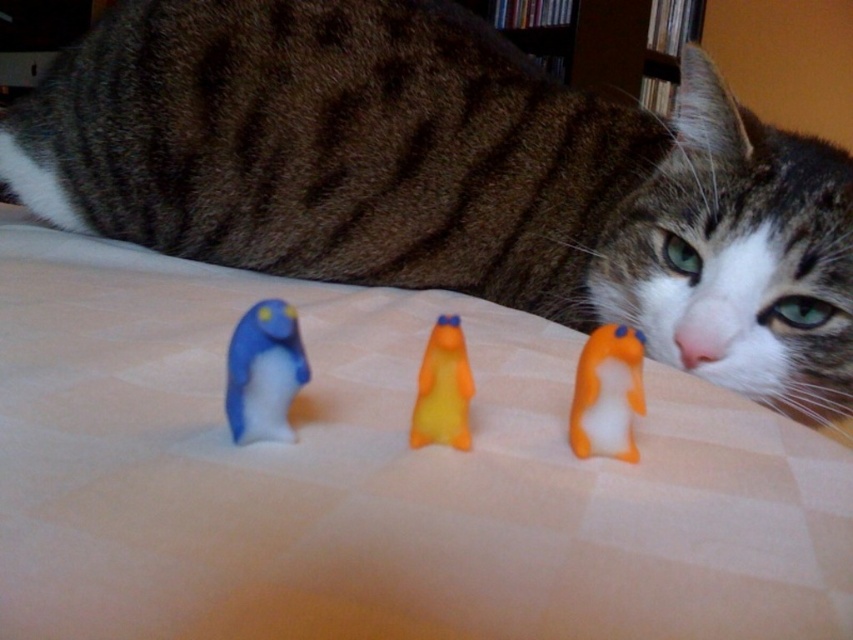
You are a cat owner trying to organize your cat toys. You see the orange matte plush toy at center and the orange rubber duck at center. Which toy is more to the right?

The orange matte plush toy at center is more to the right because it is positioned on the right side of the orange rubber duck at center.

You are a cat owner who wants to ensure your cat can reach its toys. The cat is lying on a checkered bed. You see the blue rubber duck at center and the orange matte plush toy at center. Which toy is positioned higher on the bed?

The blue rubber duck at center is positioned higher than the orange matte plush toy at center according to the description.